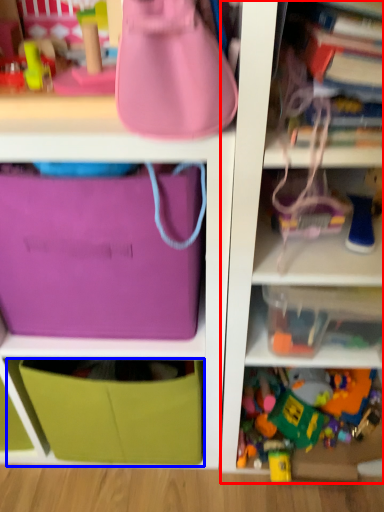
Question: Among these objects, which one is nearest to the camera, shelf (highlighted by a red box) or drawer (highlighted by a blue box)?

Choices:
 (A) shelf
 (B) drawer

Answer: (A)